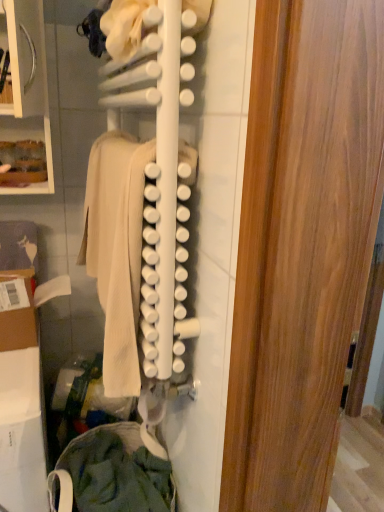
Question: Is white matte rack at center positioned in front of green cotton pants at lower left, the second clothing from the top?

Choices:
 (A) yes
 (B) no

Answer: (A)

Question: Considering the relative sizes of white matte rack at center and green cotton pants at lower left, the first clothing ordered from the bottom, in the image provided, is white matte rack at center thinner than green cotton pants at lower left, the first clothing ordered from the bottom,?

Choices:
 (A) yes
 (B) no

Answer: (A)

Question: From the image's perspective, is white matte rack at center on green cotton pants at lower left, the first clothing ordered from the bottom?

Choices:
 (A) no
 (B) yes

Answer: (B)

Question: From the image's perspective, does white matte rack at center appear lower than green cotton pants at lower left, the first clothing ordered from the bottom?

Choices:
 (A) no
 (B) yes

Answer: (A)

Question: Is white matte rack at center beside green cotton pants at lower left, the first clothing ordered from the bottom?

Choices:
 (A) no
 (B) yes

Answer: (A)

Question: Considering the positions of beige wool sweater at center, which ranks as the second clothing in bottom-to-top order, and green cotton pants at lower left, the second clothing from the top, in the image, is beige wool sweater at center, which ranks as the second clothing in bottom-to-top order, taller or shorter than green cotton pants at lower left, the second clothing from the top,?

Choices:
 (A) short
 (B) tall

Answer: (B)

Question: Is beige wool sweater at center, the 1th clothing positioned from the top, bigger or smaller than green cotton pants at lower left, the second clothing from the top?

Choices:
 (A) small
 (B) big

Answer: (A)

Question: Relative to green cotton pants at lower left, the second clothing from the top, is beige wool sweater at center, which ranks as the second clothing in bottom-to-top order, in front or behind?

Choices:
 (A) behind
 (B) front

Answer: (B)

Question: From the image's perspective, is beige wool sweater at center, which ranks as the second clothing in bottom-to-top order, positioned above or below green cotton pants at lower left, the second clothing from the top?

Choices:
 (A) below
 (B) above

Answer: (B)

Question: From a real-world perspective, is green cotton pants at lower left, the second clothing from the top, physically located above or below beige wool sweater at center, the 1th clothing positioned from the top?

Choices:
 (A) below
 (B) above

Answer: (A)

Question: From the image's perspective, is green cotton pants at lower left, the second clothing from the top, above or below beige wool sweater at center, the 1th clothing positioned from the top?

Choices:
 (A) above
 (B) below

Answer: (B)

Question: Looking at their shapes, would you say green cotton pants at lower left, the first clothing ordered from the bottom, is wider or thinner than beige wool sweater at center, the 1th clothing positioned from the top?

Choices:
 (A) thin
 (B) wide

Answer: (B)

Question: Is green cotton pants at lower left, the second clothing from the top, bigger or smaller than beige wool sweater at center, the 1th clothing positioned from the top?

Choices:
 (A) big
 (B) small

Answer: (A)

Question: From their relative heights in the image, would you say white matte rack at center is taller or shorter than green cotton pants at lower left, the second clothing from the top?

Choices:
 (A) short
 (B) tall

Answer: (B)

Question: Considering the relative positions of white matte rack at center and green cotton pants at lower left, the first clothing ordered from the bottom, in the image provided, is white matte rack at center to the left or to the right of green cotton pants at lower left, the first clothing ordered from the bottom,?

Choices:
 (A) right
 (B) left

Answer: (A)